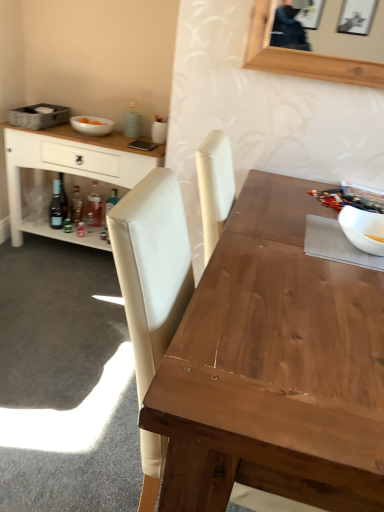
This screenshot has height=512, width=384. Identify the location of vacant area to the left of white glossy bowl at upper right, the second bowl in the top-to-bottom sequence. (312, 247).